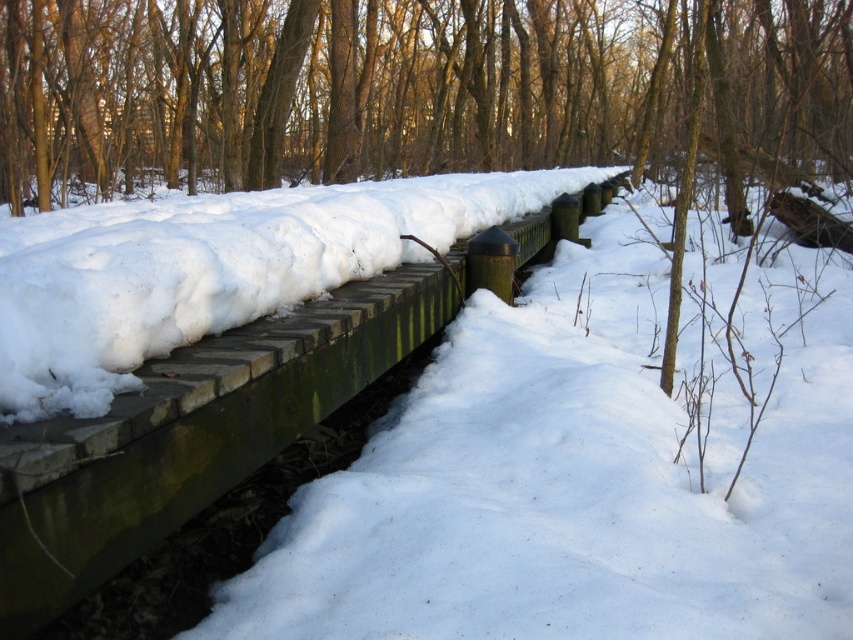
Who is lower down, brown wood tree at upper center or green wood rail at center?

green wood rail at center is lower down.

Is point (471, 145) farther from camera compared to point (544, 209)?

That is True.

Where is `brown wood tree at upper center`? brown wood tree at upper center is located at coordinates (412, 92).